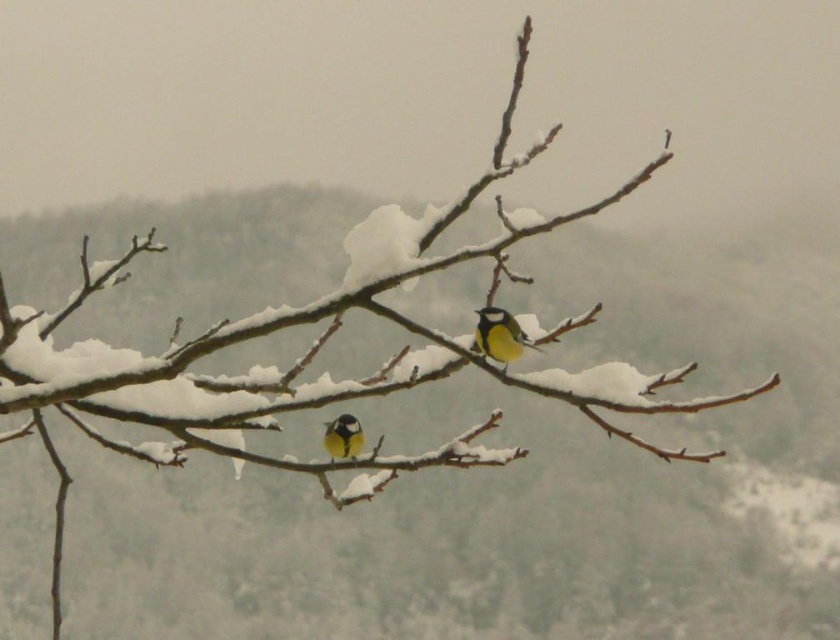
Where is `yellow matte bird at center`? This screenshot has height=640, width=840. yellow matte bird at center is located at coordinates (499, 336).

Is yellow matte bird at center positioned before yellow-green feathers at center?

That is True.

What do you see at coordinates (499, 336) in the screenshot? This screenshot has width=840, height=640. I see `yellow matte bird at center` at bounding box center [499, 336].

Where is `yellow matte bird at center`? yellow matte bird at center is located at coordinates (499, 336).